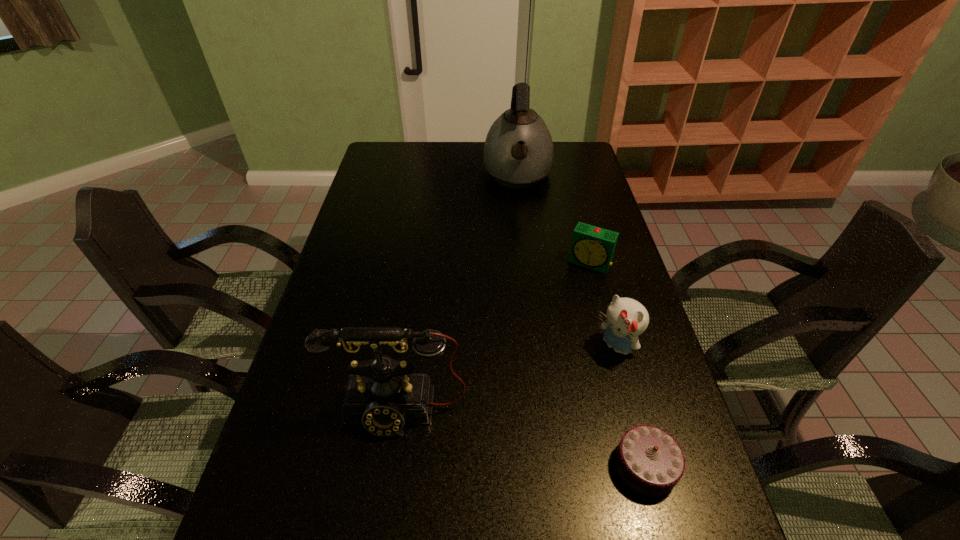
Locate an element on the screen. The width and height of the screenshot is (960, 540). free spot between the second farthest object and the farthest object is located at coordinates (553, 219).

Locate an element on the screen. The width and height of the screenshot is (960, 540). blank region between the second tallest object and the shortest object is located at coordinates (522, 438).

The height and width of the screenshot is (540, 960). In order to click on object that stands as the fourth closest to the leftmost object in this screenshot , I will do `click(518, 151)`.

At what (x,y) coordinates should I click in order to perform the action: click on the closest object relative to the farthest object. Please return your answer as a coordinate pair (x, y). Looking at the image, I should click on (592, 247).

Find the location of a particular element. This screenshot has height=540, width=960. free location that satisfies the following two spatial constraints: 1. on the dial of the telephone; 2. on the left side of the chocolate cake is located at coordinates (391, 465).